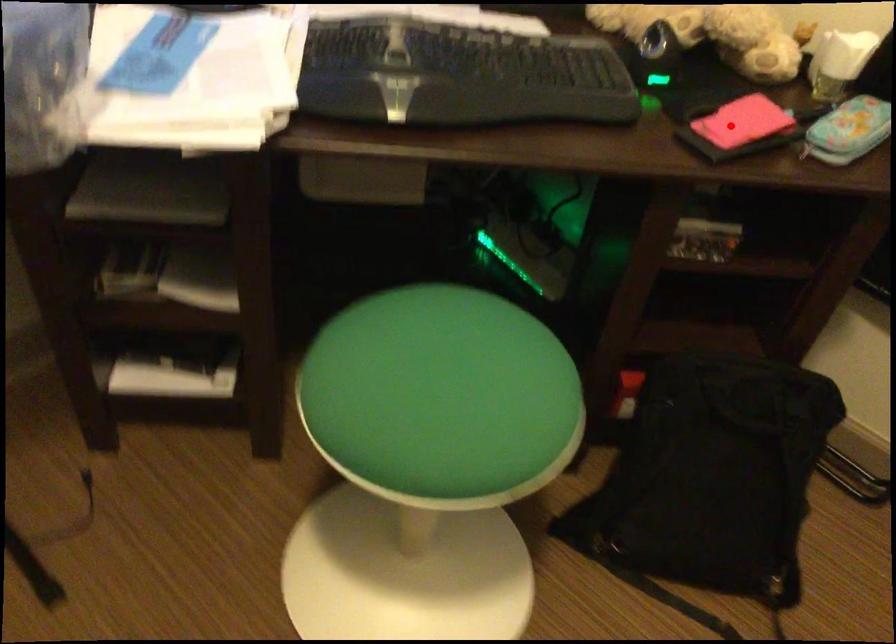
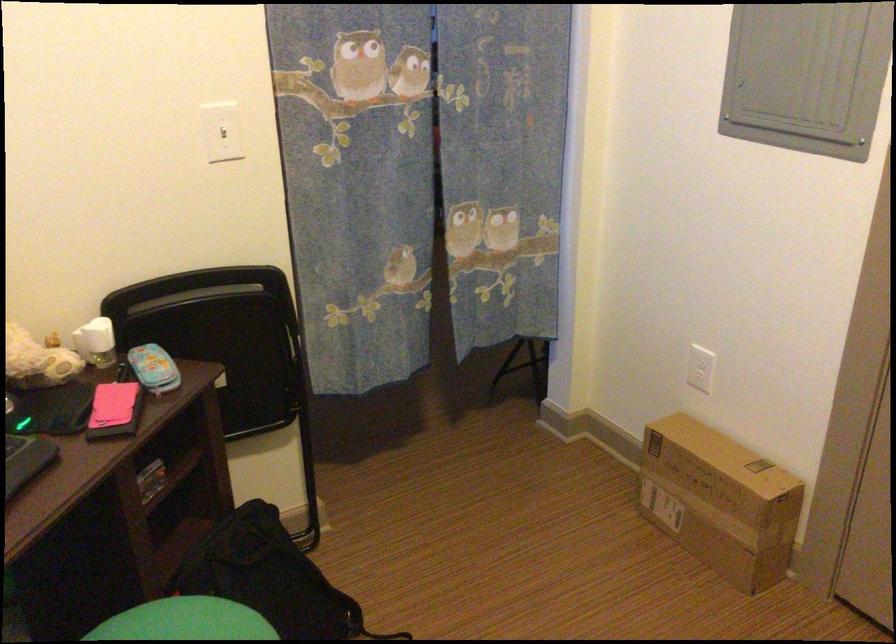
Question: I am providing you with two images of the same scene from different viewpoints. In image1, a red point is highlighted. Considering the same 3D point in image2, which of the following is correct?

Choices:
 (A) It is closer
 (B) It is farther

Answer: (B)